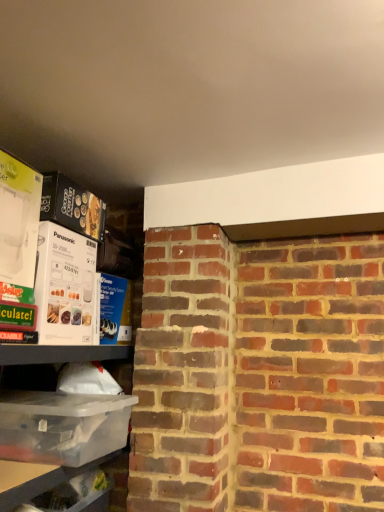
Question: From the image's perspective, is white cardboard box at upper left, positioned as the first box in top-to-bottom order, located above or below white cardboard box at left, the 2th box when ordered from bottom to top?

Choices:
 (A) below
 (B) above

Answer: (B)

Question: From a real-world perspective, is white cardboard box at upper left, which is the 3th box from bottom to top, positioned above or below white cardboard box at left, acting as the second box starting from the top?

Choices:
 (A) below
 (B) above

Answer: (B)

Question: Considering the real-world distances, which object is farthest from the white cardboard box at left, acting as the second box starting from the top?

Choices:
 (A) white cardboard box at upper left, which is the 3th box from bottom to top
 (B) transparent plastic container at lower left, arranged as the 1th box when ordered from the bottom
 (C) clear plastic container at lower left, placed as the first shelf when sorted from bottom to top
 (D) clear plastic container at left, placed as the second shelf when sorted from bottom to top

Answer: (C)

Question: Considering the real-world distances, which object is closest to the transparent plastic container at lower left, which ranks as the 3th box in top-to-bottom order?

Choices:
 (A) clear plastic container at left, placed as the second shelf when sorted from bottom to top
 (B) clear plastic container at lower left, placed as the first shelf when sorted from bottom to top
 (C) white cardboard box at left, acting as the second box starting from the top
 (D) white cardboard box at upper left, which is the 3th box from bottom to top

Answer: (A)